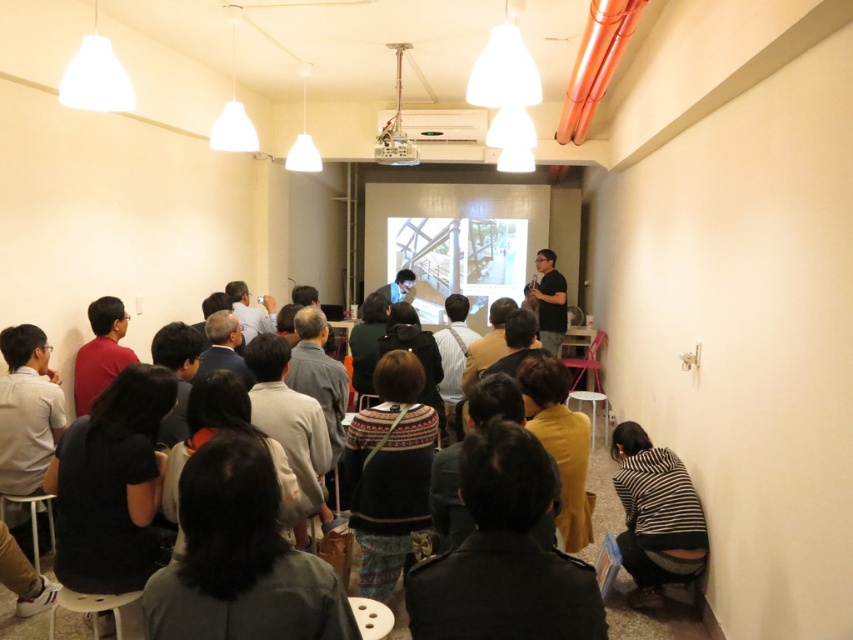
Looking at this image, can you confirm if dark green jacket at center is smaller than dark gray sweater at center?

Yes.

Is point (473, 605) in front of point (440, 472)?

Yes, it is in front of point (440, 472).

You are a GUI agent. You are given a task and a screenshot of the screen. Output one action in this format:
    pyautogui.click(x=<x>, y=<y>)
    Task: Click on the dark green jacket at center
    The image size is (853, 640).
    Given the screenshot: What is the action you would take?
    pyautogui.click(x=503, y=554)

Does matte black shirt at center have a greater width compared to dark brown sweater at center?

Yes, matte black shirt at center is wider than dark brown sweater at center.

Looking at this image, does matte black shirt at center appear over dark brown sweater at center?

Correct, matte black shirt at center is located above dark brown sweater at center.

The image size is (853, 640). What do you see at coordinates (549, 301) in the screenshot?
I see `matte black shirt at center` at bounding box center [549, 301].

Where is `matte black shirt at center`? This screenshot has height=640, width=853. matte black shirt at center is located at coordinates (549, 301).

Is matte black shirt at center further to the viewer compared to matte gray shirt at center?

Yes.

Which of these two, matte black shirt at center or matte gray shirt at center, stands shorter?

With less height is matte gray shirt at center.

Is point (561, 280) behind point (247, 300)?

Yes, point (561, 280) is behind point (247, 300).

I want to click on matte black shirt at center, so click(x=549, y=301).